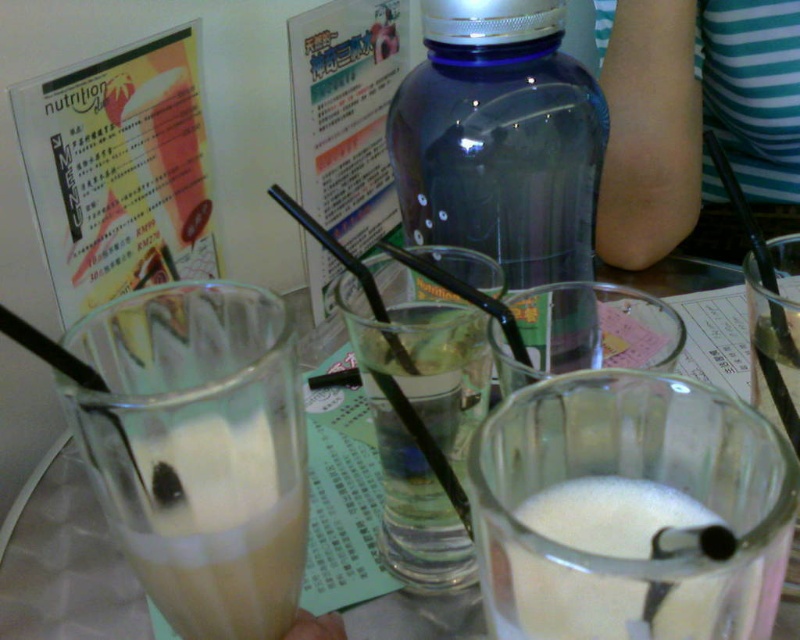
Is point (180, 419) less distant than point (302, 321)?

Yes, it is in front of point (302, 321).

The image size is (800, 640). Describe the element at coordinates (200, 451) in the screenshot. I see `milky white glass at left` at that location.

Is point (210, 458) behind point (44, 545)?

No, (210, 458) is in front of (44, 545).

Locate an element on the screen. milky white glass at left is located at coordinates (200, 451).

Which is in front, point (260, 404) or point (432, 147)?

Point (260, 404)

Can you confirm if milky white glass at left is taller than transparent plastic bottle at center?

No, milky white glass at left is not taller than transparent plastic bottle at center.

Between point (284, 620) and point (598, 157), which one is positioned in front?

Positioned in front is point (284, 620).

Locate an element on the screen. The width and height of the screenshot is (800, 640). milky white glass at left is located at coordinates [x=200, y=451].

Is point (145, 621) more distant than point (544, 508)?

Yes.

Who is positioned more to the right, clear glass cups at center or white frothy milk at lower center?

white frothy milk at lower center

Where is `clear glass cups at center`? clear glass cups at center is located at coordinates (64, 561).

Locate an element on the screen. Image resolution: width=800 pixels, height=640 pixels. clear glass cups at center is located at coordinates (64, 561).